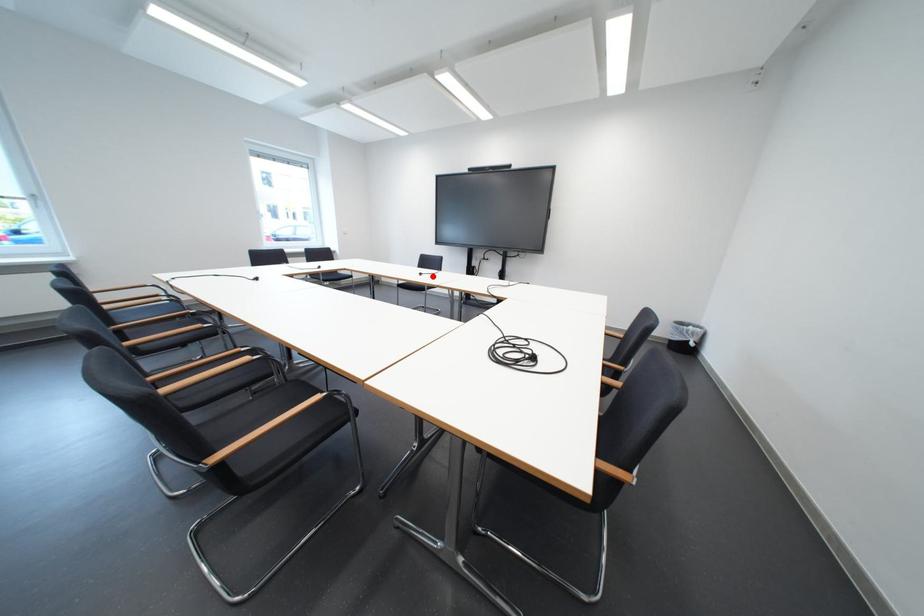
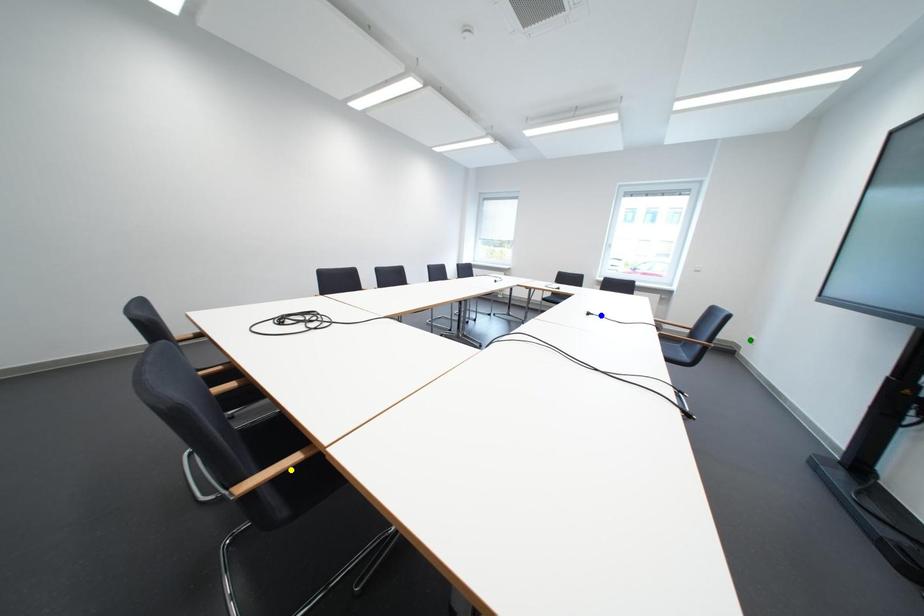
Question: I am providing you with two images of the same scene from different viewpoints. A red point is marked on the first image. You are given multiple points on the second image. Which mark in image 2 goes with the point in image 1?

Choices:
 (A) green point
 (B) yellow point
 (C) blue point

Answer: (C)